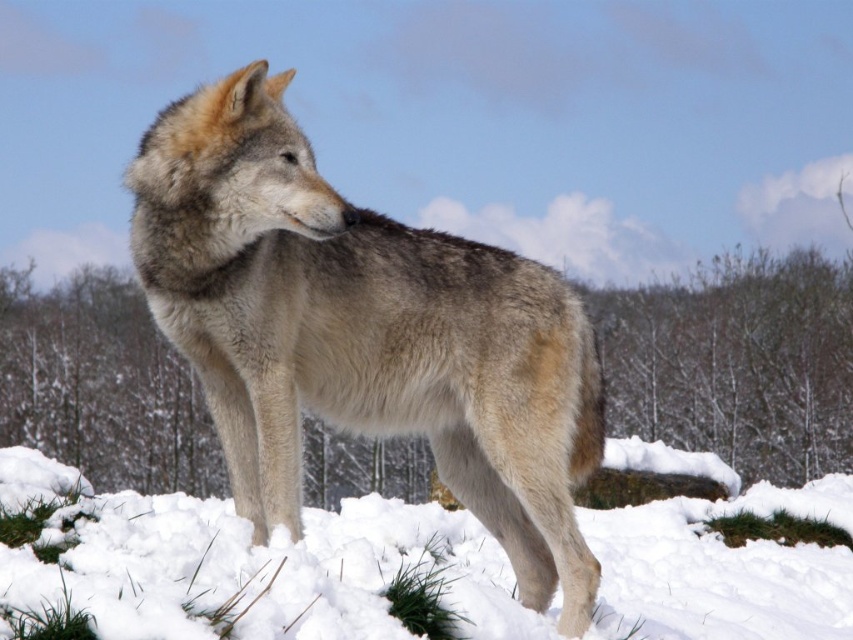
Question: Can you confirm if fuzzy fur wolf at center is wider than white fluffy snow at lower center?

Choices:
 (A) no
 (B) yes

Answer: (A)

Question: Can you confirm if fuzzy fur wolf at center is positioned to the right of white fluffy snow at lower center?

Choices:
 (A) yes
 (B) no

Answer: (A)

Question: Does fuzzy fur wolf at center appear on the left side of white fluffy snow at lower center?

Choices:
 (A) yes
 (B) no

Answer: (B)